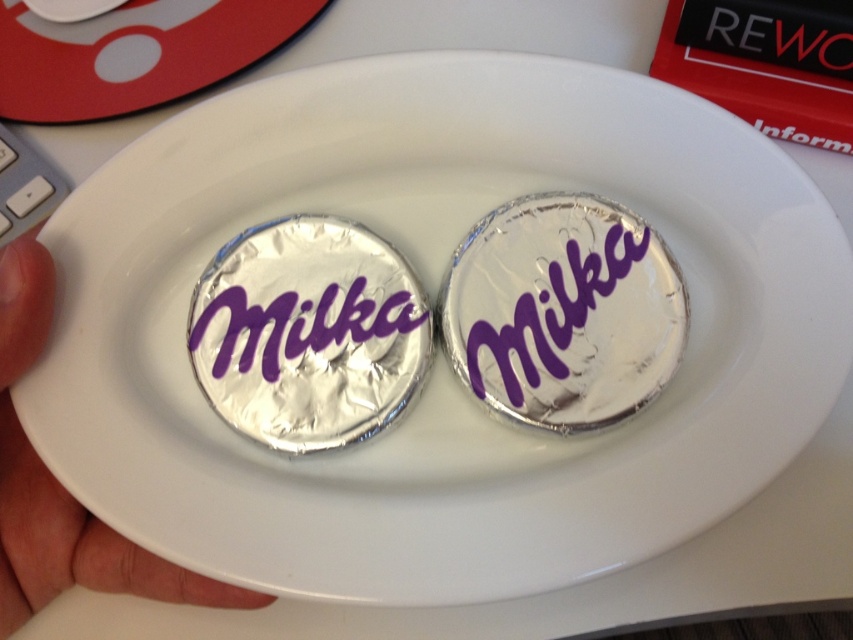
Question: Is red matte mouse pad at upper left below skinny white hand at center?

Choices:
 (A) no
 (B) yes

Answer: (A)

Question: Is red matte mouse pad at upper left behind skinny white hand at center?

Choices:
 (A) no
 (B) yes

Answer: (B)

Question: Can you confirm if red matte mouse pad at upper left is positioned to the right of skinny white hand at center?

Choices:
 (A) no
 (B) yes

Answer: (A)